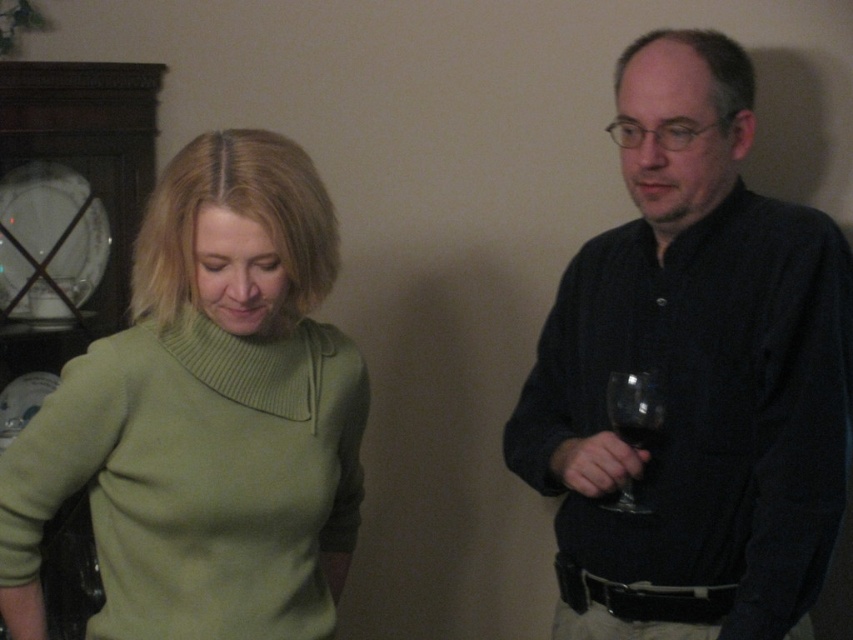
Does matte black shirt at right appear over green knitted sweater at left?

Yes, matte black shirt at right is above green knitted sweater at left.

Is matte black shirt at right smaller than green knitted sweater at left?

Actually, matte black shirt at right might be larger than green knitted sweater at left.

Between point (578, 355) and point (132, 324), which one is positioned in front?

Point (578, 355)

At what (x,y) coordinates should I click in order to perform the action: click on matte black shirt at right. Please return your answer as a coordinate pair (x, y). Looking at the image, I should click on (695, 371).

Is green knitted sweater at left thinner than transparent glass wine glass at right?

Incorrect, green knitted sweater at left's width is not less than transparent glass wine glass at right's.

Does green knitted sweater at left appear over transparent glass wine glass at right?

Yes, green knitted sweater at left is above transparent glass wine glass at right.

Which is in front, point (190, 472) or point (625, 422)?

Point (190, 472) is more forward.

Locate an element on the screen. green knitted sweater at left is located at coordinates (206, 417).

Can you confirm if matte black shirt at right is positioned above transparent glass wine glass at right?

Yes, matte black shirt at right is above transparent glass wine glass at right.

At what (x,y) coordinates should I click in order to perform the action: click on matte black shirt at right. Please return your answer as a coordinate pair (x, y). The width and height of the screenshot is (853, 640). Looking at the image, I should click on (695, 371).

Find the location of a particular element. The height and width of the screenshot is (640, 853). matte black shirt at right is located at coordinates (695, 371).